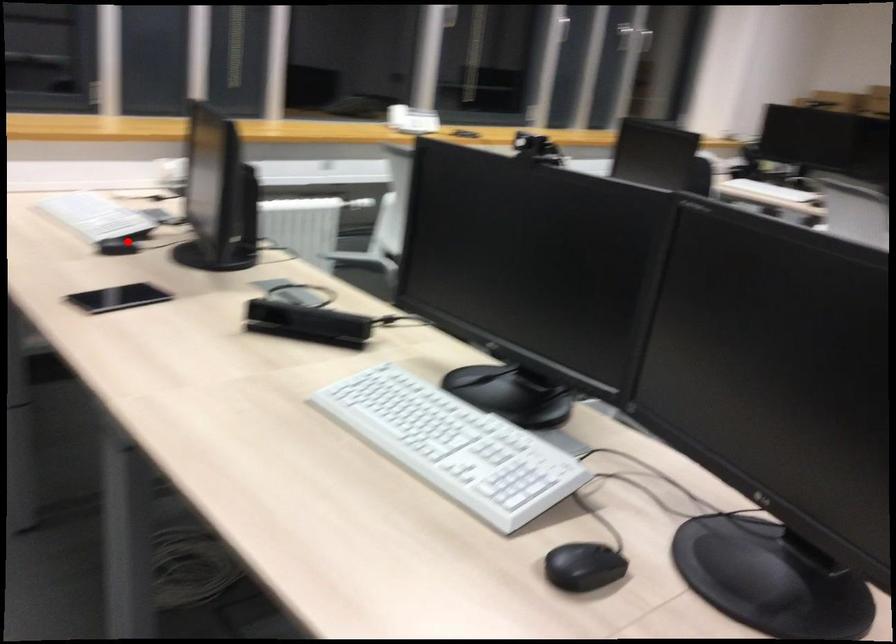
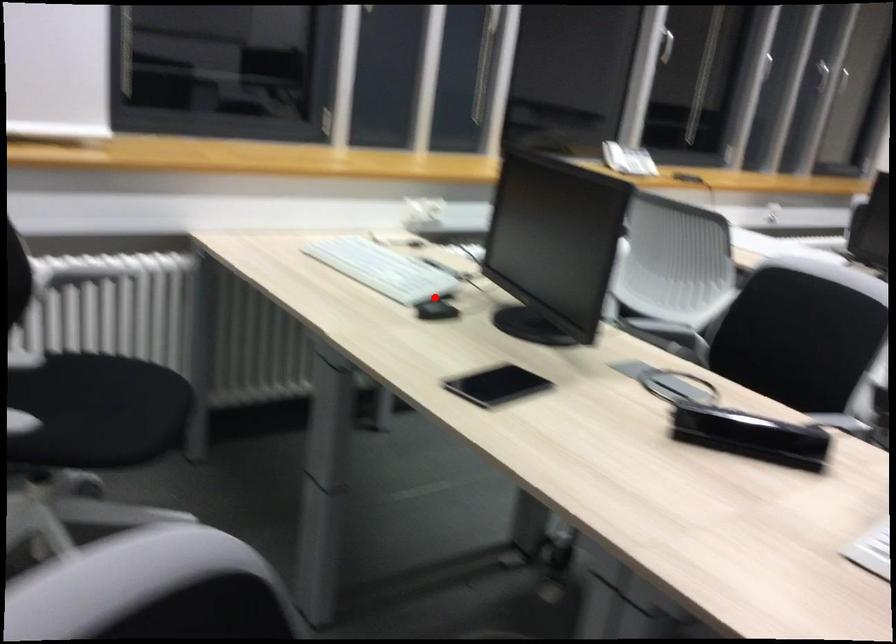
I am providing you with two images of the same scene from different viewpoints. A red point is marked on the first image and another point is marked on the second image. Are the points marked in image1 and image2 representing the same 3D position?

Yes